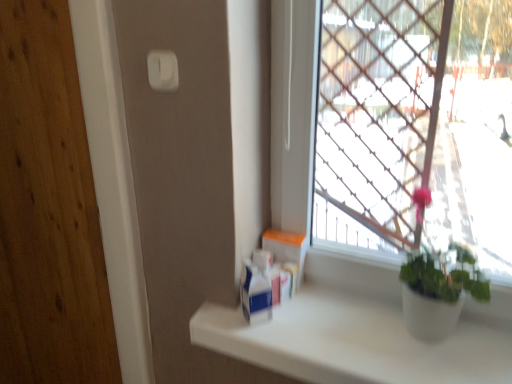
You are a GUI agent. You are given a task and a screenshot of the screen. Output one action in this format:
    pyautogui.click(x=<x>, y=<y>)
    Task: Click on the free space in front of white cardboard box at center
    The height and width of the screenshot is (384, 512).
    Given the screenshot: What is the action you would take?
    pyautogui.click(x=308, y=328)